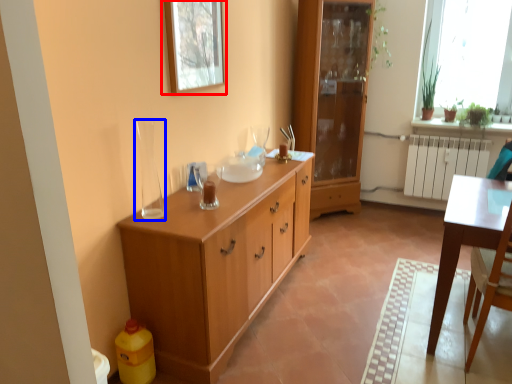
Question: Which of the following is the closest to the observer, picture frame (highlighted by a red box) or glass vase (highlighted by a blue box)?

Choices:
 (A) picture frame
 (B) glass vase

Answer: (B)